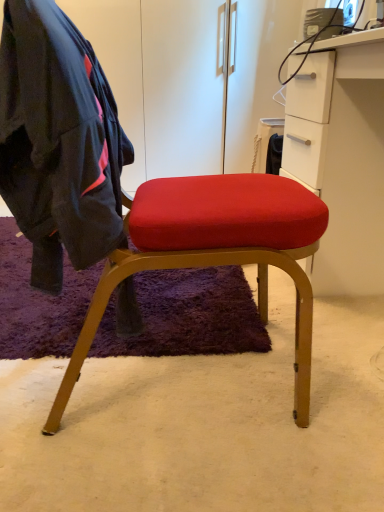
Looking at this image, in order to face dark blue fabric jacket at left, should I rotate leftwards or rightwards?

To align with it, rotate left about 16.465°.

What do you see at coordinates (58, 141) in the screenshot? I see `dark blue fabric jacket at left` at bounding box center [58, 141].

What are the coordinates of `dark blue fabric jacket at left` in the screenshot? It's located at (58, 141).

This screenshot has width=384, height=512. In order to click on white matte cabinet at right in this screenshot , I will do `click(344, 159)`.

Measure the distance between point (377, 170) and camera.

Point (377, 170) and camera are 4.20 feet apart from each other.

Image resolution: width=384 pixels, height=512 pixels. Describe the element at coordinates (344, 159) in the screenshot. I see `white matte cabinet at right` at that location.

This screenshot has width=384, height=512. I want to click on dark blue fabric jacket at left, so click(x=58, y=141).

Which object is positioned more to the left, white matte cabinet at right or dark blue fabric jacket at left?

dark blue fabric jacket at left is more to the left.

Which object is further away from the camera, white matte cabinet at right or dark blue fabric jacket at left?

white matte cabinet at right is further from the camera.

Which is closer, (355, 98) or (78, 162)?

Point (355, 98) appears to be farther away from the viewer than point (78, 162).

From the image's perspective, which object appears higher, white matte cabinet at right or dark blue fabric jacket at left?

white matte cabinet at right is shown above in the image.

From a real-world perspective, which is physically above, white matte cabinet at right or dark blue fabric jacket at left?

From a 3D spatial view, dark blue fabric jacket at left is above.

Does white matte cabinet at right have a greater width compared to dark blue fabric jacket at left?

Yes, white matte cabinet at right is wider than dark blue fabric jacket at left.

Which of these two, white matte cabinet at right or dark blue fabric jacket at left, stands taller?

white matte cabinet at right is taller.

Between white matte cabinet at right and dark blue fabric jacket at left, which one has larger size?

white matte cabinet at right.

Is white matte cabinet at right completely or partially outside of dark blue fabric jacket at left?

Yes, white matte cabinet at right is located beyond the bounds of dark blue fabric jacket at left.

Is white matte cabinet at right far from dark blue fabric jacket at left?

No, white matte cabinet at right is in close proximity to dark blue fabric jacket at left.

Is white matte cabinet at right aimed at dark blue fabric jacket at left?

Yes, white matte cabinet at right is aimed at dark blue fabric jacket at left.

How many degrees apart are the facing directions of white matte cabinet at right and dark blue fabric jacket at left?

The angular difference between white matte cabinet at right and dark blue fabric jacket at left is 178 degrees.

How distant is white matte cabinet at right from dark blue fabric jacket at left?

white matte cabinet at right and dark blue fabric jacket at left are 27.84 inches apart from each other.

Image resolution: width=384 pixels, height=512 pixels. What are the coordinates of `cabinetry that appears on the right of dark blue fabric jacket at left` in the screenshot? It's located at (344, 159).

Is dark blue fabric jacket at left to the right of white matte cabinet at right from the viewer's perspective?

In fact, dark blue fabric jacket at left is to the left of white matte cabinet at right.

Is dark blue fabric jacket at left positioned behind white matte cabinet at right?

No, the depth of dark blue fabric jacket at left is less than that of white matte cabinet at right.

Which is behind, point (12, 78) or point (354, 223)?

Point (354, 223)

From the picture: From the image's perspective, which is above, dark blue fabric jacket at left or white matte cabinet at right?

From the image's view, white matte cabinet at right is above.

From a real-world perspective, does dark blue fabric jacket at left stand above white matte cabinet at right?

Yes, from a real-world perspective, dark blue fabric jacket at left is on top of white matte cabinet at right.

Looking at this image, in terms of width, does dark blue fabric jacket at left look wider or thinner when compared to white matte cabinet at right?

dark blue fabric jacket at left is thinner than white matte cabinet at right.

In the scene shown: Is dark blue fabric jacket at left taller than white matte cabinet at right?

In fact, dark blue fabric jacket at left may be shorter than white matte cabinet at right.

Considering the sizes of dark blue fabric jacket at left and white matte cabinet at right in the image, is dark blue fabric jacket at left bigger or smaller than white matte cabinet at right?

dark blue fabric jacket at left is smaller than white matte cabinet at right.

Can white matte cabinet at right be found inside dark blue fabric jacket at left?

No, white matte cabinet at right is not a part of dark blue fabric jacket at left.

Is dark blue fabric jacket at left directly adjacent to white matte cabinet at right?

No, dark blue fabric jacket at left is not next to white matte cabinet at right.

Is dark blue fabric jacket at left looking in the opposite direction of white matte cabinet at right?

That's not correct — dark blue fabric jacket at left is not looking away from white matte cabinet at right.

What's the angular difference between dark blue fabric jacket at left and white matte cabinet at right's facing directions?

The angular difference between dark blue fabric jacket at left and white matte cabinet at right is 178 degrees.

You are a GUI agent. You are given a task and a screenshot of the screen. Output one action in this format:
    pyautogui.click(x=<x>, y=<y>)
    Task: Click on the cabinetry lying on the right of dark blue fabric jacket at left
    The width and height of the screenshot is (384, 512).
    Given the screenshot: What is the action you would take?
    pyautogui.click(x=344, y=159)

Image resolution: width=384 pixels, height=512 pixels. In order to click on clothing on the left of white matte cabinet at right in this screenshot , I will do `click(58, 141)`.

What are the coordinates of `clothing lying in front of the white matte cabinet at right` in the screenshot? It's located at tap(58, 141).